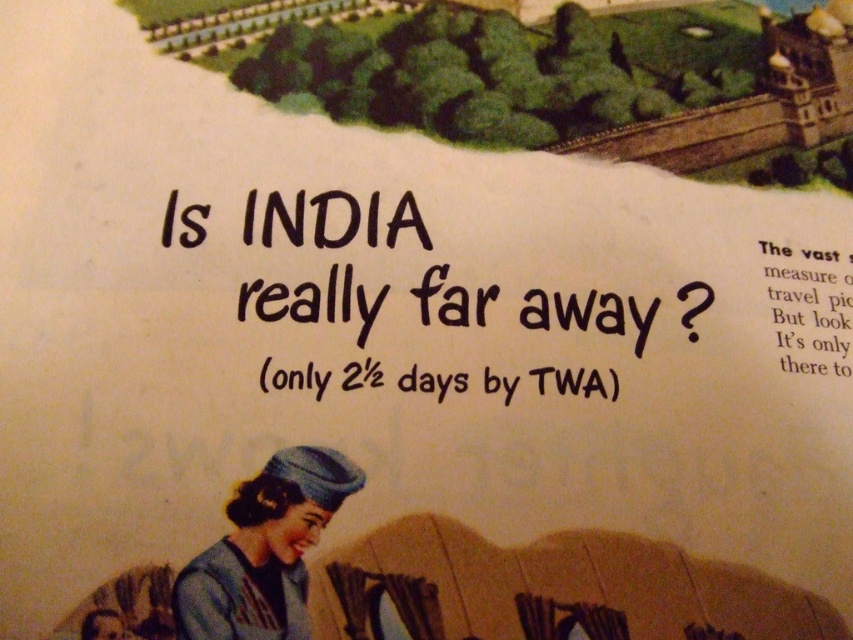
Question: Is black ink text at center to the right of black paper text at upper right from the viewer's perspective?

Choices:
 (A) no
 (B) yes

Answer: (A)

Question: Is black ink text at center smaller than matte blue hat at lower left?

Choices:
 (A) no
 (B) yes

Answer: (A)

Question: Which object appears closest to the camera in this image?

Choices:
 (A) black ink text at center
 (B) matte blue hat at lower left
 (C) black paper text at upper right

Answer: (B)

Question: Which of the following is the closest to the observer?

Choices:
 (A) black paper text at upper right
 (B) black ink text at center

Answer: (B)

Question: Is black ink text at center smaller than black paper text at upper right?

Choices:
 (A) no
 (B) yes

Answer: (A)

Question: Which object is positioned closest to the black ink text at center?

Choices:
 (A) matte blue hat at lower left
 (B) black paper text at upper right

Answer: (A)